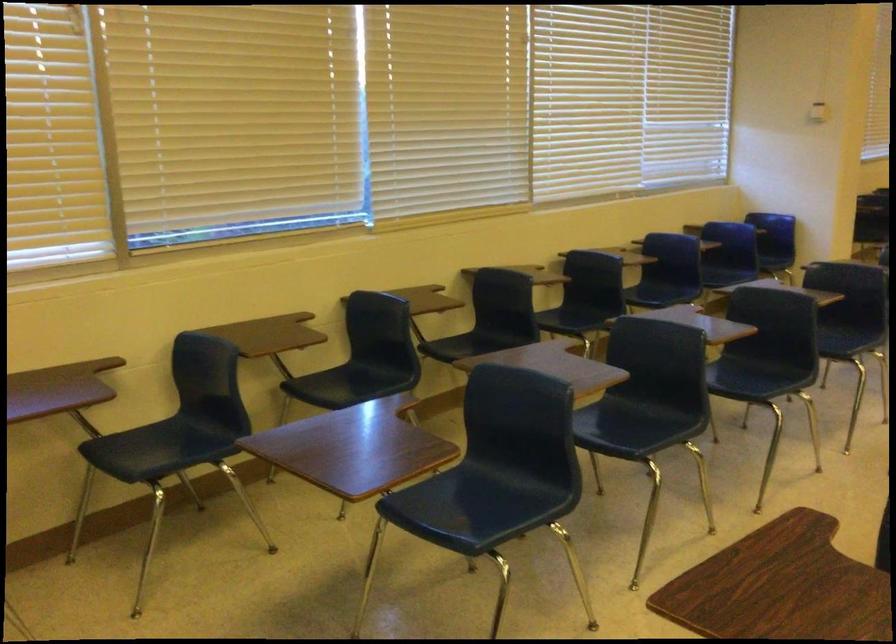
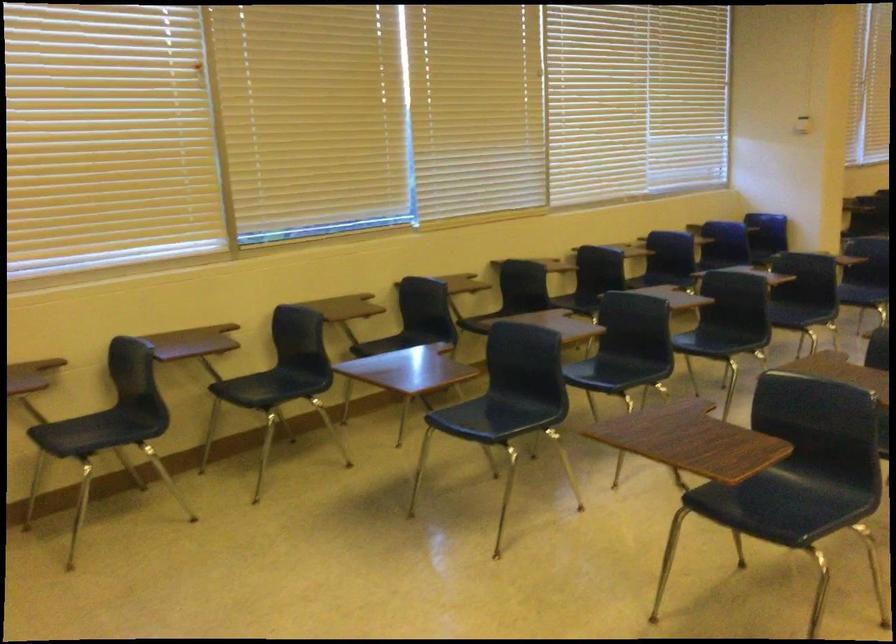
Question: How did the camera likely rotate?

Choices:
 (A) Left
 (B) Right
 (C) Up
 (D) Down

Answer: (A)